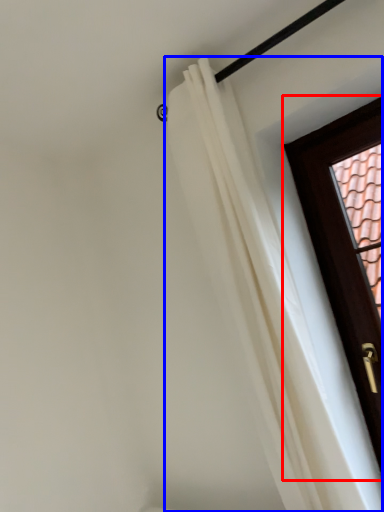
Question: Which object is closer to the camera taking this photo, door (highlighted by a red box) or curtain (highlighted by a blue box)?

Choices:
 (A) door
 (B) curtain

Answer: (B)